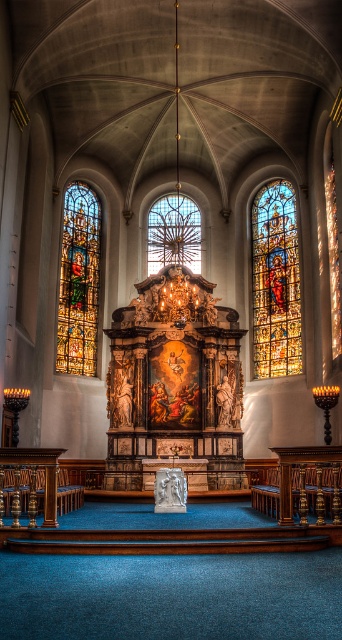
Is point (272, 336) positioned after point (189, 230)?

No, (272, 336) is in front of (189, 230).

Which of these two, stained glass window at right or clear stained glass at center, stands shorter?

Standing shorter between the two is clear stained glass at center.

Locate an element on the screen. This screenshot has width=342, height=640. stained glass window at right is located at coordinates 275,282.

Which of these two, stained glass window at left or clear stained glass at center, stands taller?

stained glass window at left is taller.

Describe the element at coordinates (79, 282) in the screenshot. This screenshot has height=640, width=342. I see `stained glass window at left` at that location.

This screenshot has height=640, width=342. Find the location of `stained glass window at left`. stained glass window at left is located at coordinates (79, 282).

Can you confirm if stained glass window at right is wider than stained glass window at left?

Result: Yes, stained glass window at right is wider than stained glass window at left.

How distant is stained glass window at right from stained glass window at left?

stained glass window at right and stained glass window at left are 27.35 meters apart.

Does point (259, 224) come farther from viewer compared to point (67, 198)?

That is True.

Where is `stained glass window at right`? The height and width of the screenshot is (640, 342). stained glass window at right is located at coordinates (275, 282).